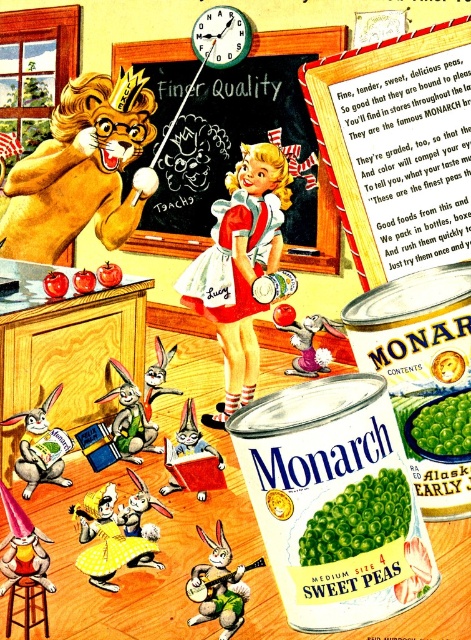
Question: Can you confirm if matte red dress at center is bigger than green matte sweet peas at center?

Choices:
 (A) yes
 (B) no

Answer: (A)

Question: Does wooden frame at upper center have a larger size compared to brushed metal stool at lower left?

Choices:
 (A) no
 (B) yes

Answer: (B)

Question: Which of the following is the farthest from the observer?

Choices:
 (A) golden fur lion at upper left
 (B) green felt rabbit at lower center

Answer: (A)

Question: Which point appears closest to the camera in this image?

Choices:
 (A) (409, 502)
 (B) (46, 481)

Answer: (A)

Question: Does wooden frame at upper center have a larger size compared to green matte peas at center?

Choices:
 (A) no
 (B) yes

Answer: (B)

Question: Which point appears closest to the camera in this image?

Choices:
 (A) (363, 541)
 (B) (256, 339)
 (C) (185, 44)
 (D) (63, 154)

Answer: (A)